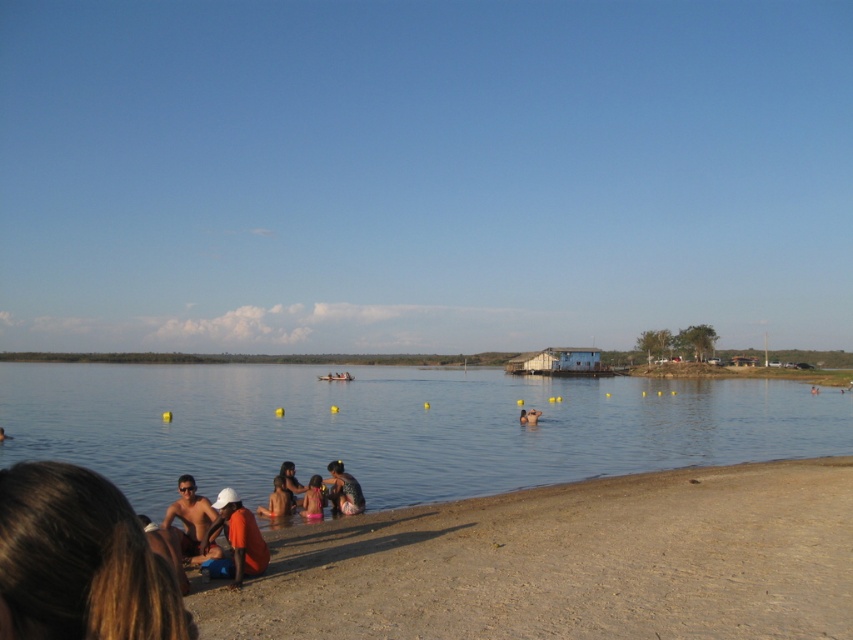
Based on the photo, does shiny orange shirt at lower left have a larger size compared to orange fabric at lower left?

Actually, shiny orange shirt at lower left might be smaller than orange fabric at lower left.

Who is more forward, [27,492] or [247,566]?

Point [27,492] is in front.

Locate an element on the screen. The height and width of the screenshot is (640, 853). shiny orange shirt at lower left is located at coordinates (79, 561).

Where is `shiny orange shirt at lower left`? shiny orange shirt at lower left is located at coordinates (79, 561).

Does point (573, 476) come farther from viewer compared to point (9, 436)?

No.

In order to click on clear water at beach center in this screenshot , I will do `click(396, 426)`.

Does orange fabric at lower left have a greater height compared to pink fabric at lower center?

Yes.

Describe the element at coordinates (235, 541) in the screenshot. This screenshot has height=640, width=853. I see `orange fabric at lower left` at that location.

Is point (215, 499) positioned behind point (306, 499)?

No, it is in front of (306, 499).

The width and height of the screenshot is (853, 640). What are the coordinates of `orange fabric at lower left` in the screenshot? It's located at (235, 541).